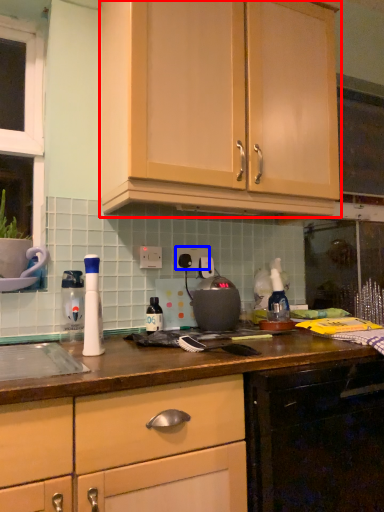
Question: Which of the following is the farthest to the observer, cabinetry (highlighted by a red box) or electric outlet (highlighted by a blue box)?

Choices:
 (A) cabinetry
 (B) electric outlet

Answer: (B)